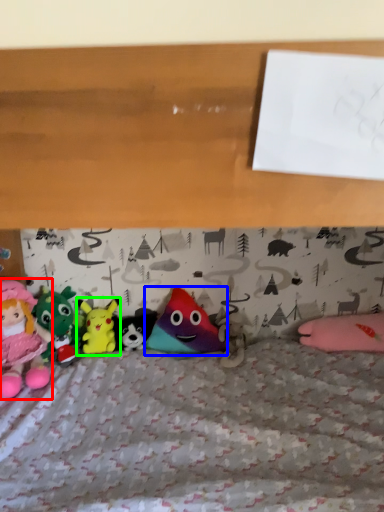
Question: Considering the real-world distances, which object is farthest from toy (highlighted by a red box)? toy (highlighted by a blue box) or toy (highlighted by a green box)?

Choices:
 (A) toy
 (B) toy

Answer: (A)